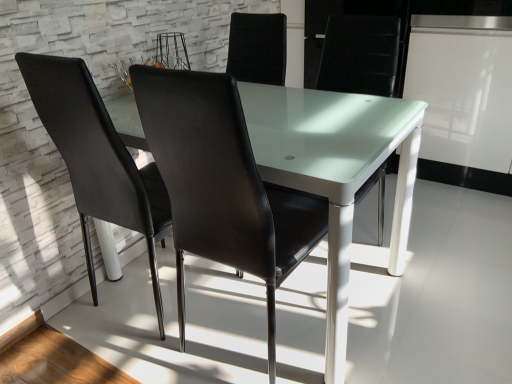
Question: From the image's perspective, is transparent glass table at center above or below black leather chair at center, which appears as the 1th chair when viewed from the right?

Choices:
 (A) above
 (B) below

Answer: (A)

Question: In terms of size, does transparent glass table at center appear bigger or smaller than black leather chair at center, which appears as the 1th chair when viewed from the right?

Choices:
 (A) big
 (B) small

Answer: (A)

Question: Which of these objects is positioned closest to the transparent glass table at center?

Choices:
 (A) black leather chair at center, which appears as the 1th chair when viewed from the right
 (B) black leather chair at left, placed as the second chair when sorted from right to left

Answer: (A)

Question: Which of these objects is positioned farthest from the transparent glass table at center?

Choices:
 (A) black leather chair at center, which appears as the 1th chair when viewed from the right
 (B) black leather chair at left, positioned as the first chair in left-to-right order

Answer: (B)